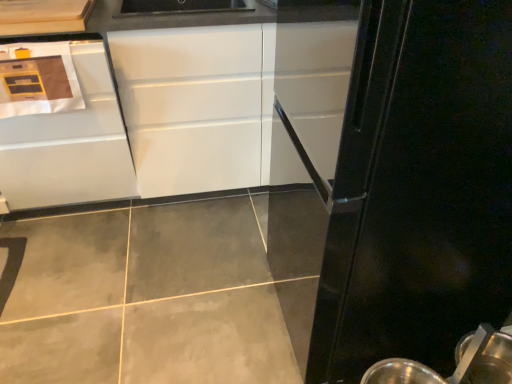
I want to click on white glossy cabinet at center, the first cabinetry positioned from the right, so click(x=191, y=107).

Describe the element at coordinates (419, 189) in the screenshot. This screenshot has height=384, width=512. I see `black glossy refrigerator at right` at that location.

Where is `white glossy cabinet at left, the 2th cabinetry positioned from the right`? The image size is (512, 384). white glossy cabinet at left, the 2th cabinetry positioned from the right is located at coordinates (x=66, y=135).

Is black glossy refrigerator at right placed right next to white glossy cabinet at center, the first cabinetry positioned from the right?

No, black glossy refrigerator at right is not touching white glossy cabinet at center, the first cabinetry positioned from the right.

Which is behind, point (346, 378) or point (145, 191)?

The point (145, 191) is behind.

From the picture: Considering the relative positions of black glossy refrigerator at right and white glossy cabinet at center, the first cabinetry positioned from the right, in the image provided, is black glossy refrigerator at right to the left of white glossy cabinet at center, the first cabinetry positioned from the right, from the viewer's perspective?

No, black glossy refrigerator at right is not to the left of white glossy cabinet at center, the first cabinetry positioned from the right.

Can you tell me how much black glossy refrigerator at right and white glossy cabinet at left, the 2th cabinetry positioned from the right, differ in facing direction?

There is a 91.1-degree angle between the facing directions of black glossy refrigerator at right and white glossy cabinet at left, the 2th cabinetry positioned from the right.

The width and height of the screenshot is (512, 384). What are the coordinates of `glass door on the right of white glossy cabinet at left, the 2th cabinetry positioned from the right` in the screenshot? It's located at (419, 189).

Between black glossy refrigerator at right and white glossy cabinet at left, the 2th cabinetry positioned from the right, which one has more height?

black glossy refrigerator at right.

Based on the photo, does black glossy refrigerator at right have a smaller size compared to white glossy cabinet at left, the 2th cabinetry positioned from the right?

No.

Is white glossy cabinet at center, acting as the 2th cabinetry starting from the left, turned away from white glossy cabinet at left, the 2th cabinetry positioned from the right?

Yes, white glossy cabinet at center, acting as the 2th cabinetry starting from the left,'s orientation is away from white glossy cabinet at left, the 2th cabinetry positioned from the right.

Is white glossy cabinet at center, acting as the 2th cabinetry starting from the left, thinner than white glossy cabinet at left, the 2th cabinetry positioned from the right?

Yes.

Which is closer to the camera, (260, 41) or (16, 163)?

The point (260, 41) is closer.

Based on their positions, is white glossy cabinet at center, acting as the 2th cabinetry starting from the left, located to the left or right of white glossy cabinet at left, the 1th cabinetry from the left?

white glossy cabinet at center, acting as the 2th cabinetry starting from the left, is positioned on white glossy cabinet at left, the 1th cabinetry from the left,'s right side.

Does white glossy cabinet at left, the 2th cabinetry positioned from the right, have a smaller size compared to white glossy cabinet at center, acting as the 2th cabinetry starting from the left?

Yes, white glossy cabinet at left, the 2th cabinetry positioned from the right, is smaller than white glossy cabinet at center, acting as the 2th cabinetry starting from the left.

From the image's perspective, between white glossy cabinet at left, the 1th cabinetry from the left, and white glossy cabinet at center, acting as the 2th cabinetry starting from the left, who is located below?

white glossy cabinet at left, the 1th cabinetry from the left, is shown below in the image.

Is white glossy cabinet at left, the 1th cabinetry from the left, to the left of white glossy cabinet at center, the first cabinetry positioned from the right, from the viewer's perspective?

Indeed, white glossy cabinet at left, the 1th cabinetry from the left, is positioned on the left side of white glossy cabinet at center, the first cabinetry positioned from the right.

Can you confirm if white glossy cabinet at left, the 1th cabinetry from the left, is shorter than white glossy cabinet at center, the first cabinetry positioned from the right?

Indeed, white glossy cabinet at left, the 1th cabinetry from the left, has a lesser height compared to white glossy cabinet at center, the first cabinetry positioned from the right.

From a real-world perspective, who is located higher, metallic silver spoon at lower right or black glossy refrigerator at right?

In real-world perspective, black glossy refrigerator at right is above.

Is metallic silver spoon at lower right positioned with its back to black glossy refrigerator at right?

Yes, metallic silver spoon at lower right is positioned with its back facing black glossy refrigerator at right.

Which point is more distant from viewer, (490, 373) or (426, 248)?

The point (490, 373) is behind.

Would you say black glossy refrigerator at right is part of metallic silver spoon at lower right's contents?

No, black glossy refrigerator at right is located outside of metallic silver spoon at lower right.

Considering the sizes of metallic silver spoon at lower right and white glossy cabinet at center, acting as the 2th cabinetry starting from the left, in the image, is metallic silver spoon at lower right bigger or smaller than white glossy cabinet at center, acting as the 2th cabinetry starting from the left,?

In the image, metallic silver spoon at lower right appears to be smaller than white glossy cabinet at center, acting as the 2th cabinetry starting from the left.

From the image's perspective, is metallic silver spoon at lower right located beneath white glossy cabinet at center, the first cabinetry positioned from the right?

Yes, from the image's perspective, metallic silver spoon at lower right is below white glossy cabinet at center, the first cabinetry positioned from the right.

Consider the image. Is metallic silver spoon at lower right completely or partially outside of white glossy cabinet at center, the first cabinetry positioned from the right?

Yes, metallic silver spoon at lower right is outside of white glossy cabinet at center, the first cabinetry positioned from the right.

Is the depth of metallic silver spoon at lower right greater than that of white glossy cabinet at center, the first cabinetry positioned from the right?

No, it is in front of white glossy cabinet at center, the first cabinetry positioned from the right.

Is white glossy cabinet at center, the first cabinetry positioned from the right, taller or shorter than metallic silver spoon at lower right?

In the image, white glossy cabinet at center, the first cabinetry positioned from the right, appears to be taller than metallic silver spoon at lower right.

Consider the image. Which is in front, white glossy cabinet at center, the first cabinetry positioned from the right, or metallic silver spoon at lower right?

metallic silver spoon at lower right is more forward.

Are white glossy cabinet at center, the first cabinetry positioned from the right, and metallic silver spoon at lower right located far from each other?

white glossy cabinet at center, the first cabinetry positioned from the right, is positioned a significant distance from metallic silver spoon at lower right.

Looking at this image, how different are the orientations of white glossy cabinet at center, the first cabinetry positioned from the right, and metallic silver spoon at lower right in degrees?

The angle between the facing direction of white glossy cabinet at center, the first cabinetry positioned from the right, and the facing direction of metallic silver spoon at lower right is 0.549 degrees.

This screenshot has height=384, width=512. What are the coordinates of `the 1st cabinetry located beneath the black glossy refrigerator at right (from a real-world perspective)` in the screenshot? It's located at (191, 107).

What are the coordinates of `glass door that appears on the right of white glossy cabinet at left, the 1th cabinetry from the left` in the screenshot? It's located at (419, 189).

Looking at the image, which one is located further to white glossy cabinet at left, the 2th cabinetry positioned from the right, white glossy cabinet at center, the first cabinetry positioned from the right, or metallic silver spoon at lower right?

metallic silver spoon at lower right lies further to white glossy cabinet at left, the 2th cabinetry positioned from the right, than the other object.

From the image, which object appears to be nearer to white glossy cabinet at left, the 1th cabinetry from the left, black glossy refrigerator at right or metallic silver spoon at lower right?

black glossy refrigerator at right lies closer to white glossy cabinet at left, the 1th cabinetry from the left, than the other object.

In the scene shown: Estimate the real-world distances between objects in this image. Which object is closer to white glossy cabinet at center, the first cabinetry positioned from the right, white glossy cabinet at left, the 1th cabinetry from the left, or black glossy refrigerator at right?

white glossy cabinet at left, the 1th cabinetry from the left, lies closer to white glossy cabinet at center, the first cabinetry positioned from the right, than the other object.

Estimate the real-world distances between objects in this image. Which object is further from white glossy cabinet at center, the first cabinetry positioned from the right, white glossy cabinet at left, the 2th cabinetry positioned from the right, or metallic silver spoon at lower right?

Among the two, metallic silver spoon at lower right is located further to white glossy cabinet at center, the first cabinetry positioned from the right.

Based on their spatial positions, is metallic silver spoon at lower right or black glossy refrigerator at right further from white glossy cabinet at left, the 2th cabinetry positioned from the right?

metallic silver spoon at lower right.

Consider the image. Considering their positions, is white glossy cabinet at center, the first cabinetry positioned from the right, positioned further to white glossy cabinet at left, the 2th cabinetry positioned from the right, than black glossy refrigerator at right?

black glossy refrigerator at right.

From the image, which object appears to be farther from metallic silver spoon at lower right, black glossy refrigerator at right or white glossy cabinet at center, acting as the 2th cabinetry starting from the left?

white glossy cabinet at center, acting as the 2th cabinetry starting from the left, lies further to metallic silver spoon at lower right than the other object.

Which object lies further to the anchor point black glossy refrigerator at right, white glossy cabinet at center, the first cabinetry positioned from the right, or metallic silver spoon at lower right?

white glossy cabinet at center, the first cabinetry positioned from the right, is further to black glossy refrigerator at right.

Where is `cabinetry situated between white glossy cabinet at left, the 2th cabinetry positioned from the right, and metallic silver spoon at lower right from left to right`? cabinetry situated between white glossy cabinet at left, the 2th cabinetry positioned from the right, and metallic silver spoon at lower right from left to right is located at coordinates (191, 107).

Identify the location of glass door between white glossy cabinet at center, the first cabinetry positioned from the right, and metallic silver spoon at lower right. (419, 189).

Where is `glass door between white glossy cabinet at left, the 1th cabinetry from the left, and metallic silver spoon at lower right from left to right`? Image resolution: width=512 pixels, height=384 pixels. glass door between white glossy cabinet at left, the 1th cabinetry from the left, and metallic silver spoon at lower right from left to right is located at coordinates (419, 189).

Where is `cabinetry between white glossy cabinet at left, the 2th cabinetry positioned from the right, and black glossy refrigerator at right`? cabinetry between white glossy cabinet at left, the 2th cabinetry positioned from the right, and black glossy refrigerator at right is located at coordinates (191, 107).